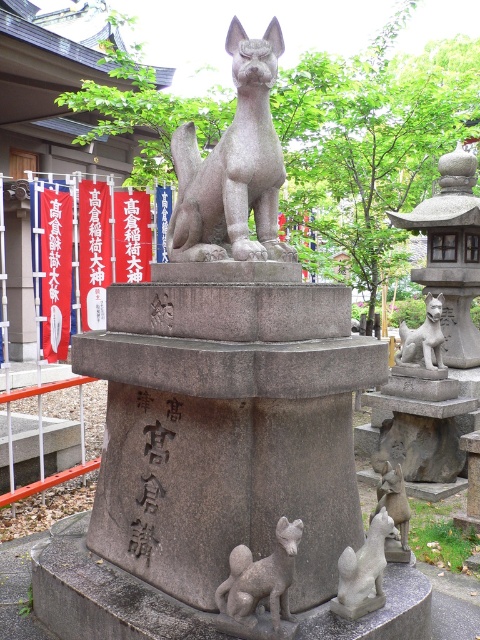
In the scene shown: You are a visitor at the shrine and want to take a photo of both the stone lantern at center and the gray stone dog at center. Since you only have one shot, will you be able to capture both in the same frame if you stand where you are?

The gray stone dog at center is behind the stone lantern at center, so both can be captured in the same frame as they are aligned along the depth.

You are visiting a traditional Japanese shrine and notice two statues. The granite statue at center and the gray stone fox at lower right. Which one is taller?

The granite statue at center is taller than the gray stone fox at lower right.